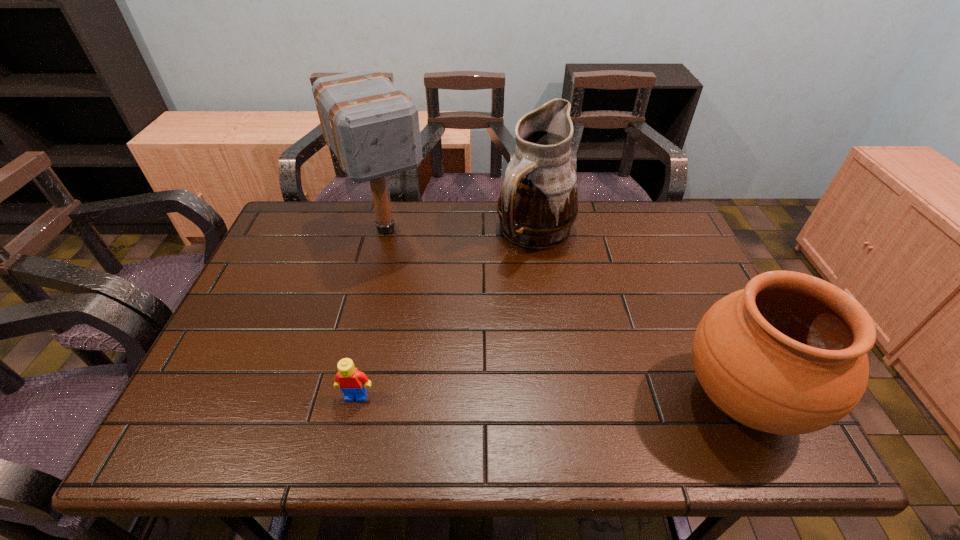
Locate an element on the screen. vacant space in between the Lego and the rightmost object is located at coordinates (549, 397).

Find the location of `free space between the Lego and the mallet`. free space between the Lego and the mallet is located at coordinates (372, 313).

Locate an element on the screen. vacant space that's between the third shortest object and the shortest object is located at coordinates click(x=445, y=315).

This screenshot has height=540, width=960. In order to click on object that is the second nearest to the mallet in this screenshot , I will do `click(351, 381)`.

In order to click on object identified as the third closest to the mallet in this screenshot , I will do `click(787, 355)`.

Find the location of `free space that satisfies the following two spatial constraints: 1. on the face of the rightmost object; 2. on the left side of the shortest object`. free space that satisfies the following two spatial constraints: 1. on the face of the rightmost object; 2. on the left side of the shortest object is located at coordinates (356, 399).